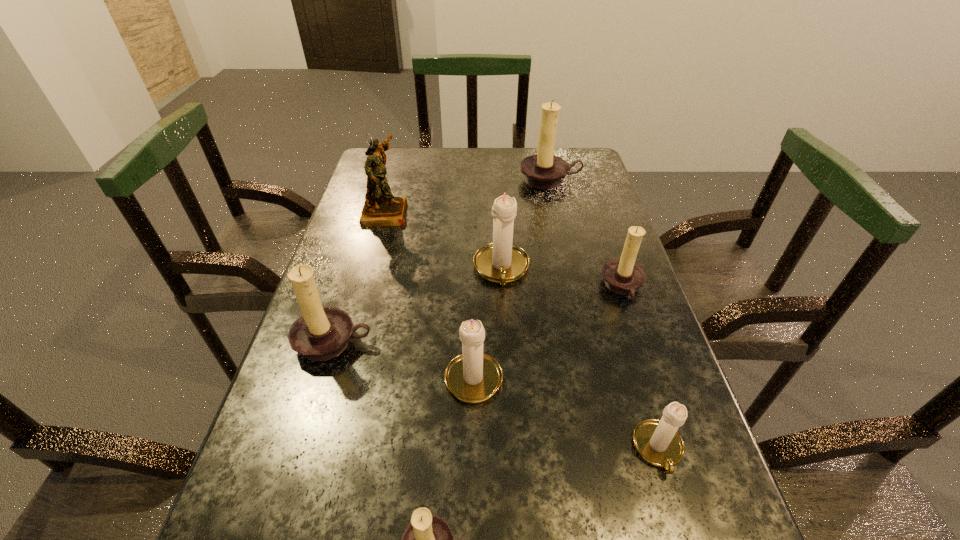
The height and width of the screenshot is (540, 960). What are the coordinates of `the closest white candle holder to the second nearest white candle holder` in the screenshot? It's located at (501, 261).